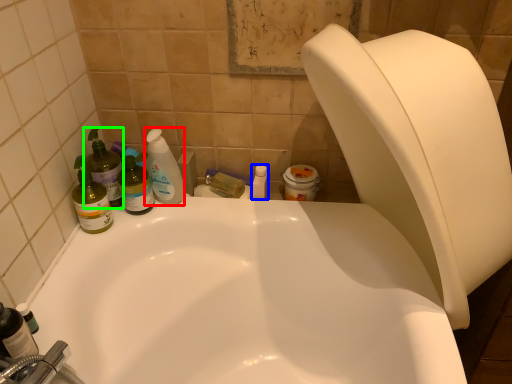
Question: Which is farther away from cleaning product (highlighted by a red box)? toiletry (highlighted by a blue box) or cleaning product (highlighted by a green box)?

Choices:
 (A) toiletry
 (B) cleaning product

Answer: (A)